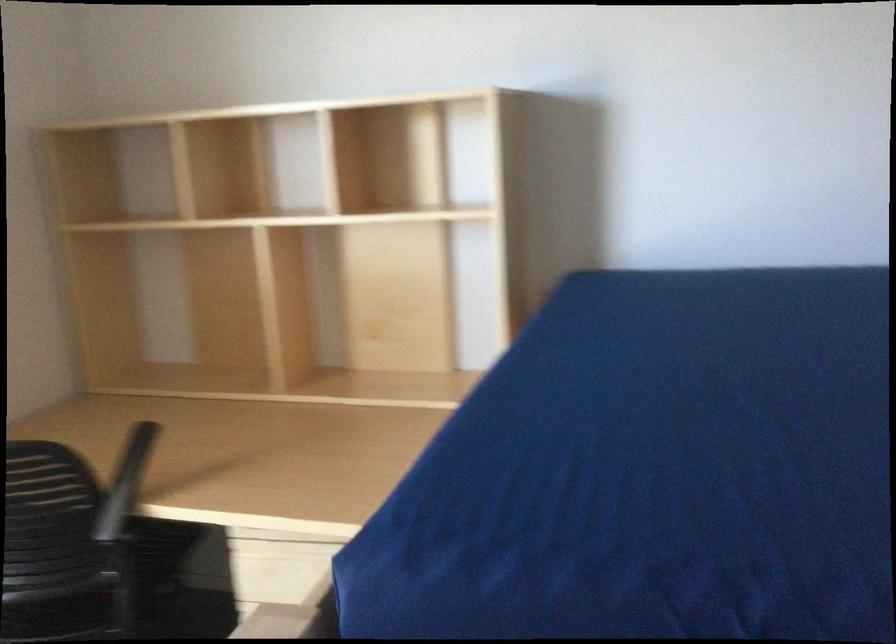
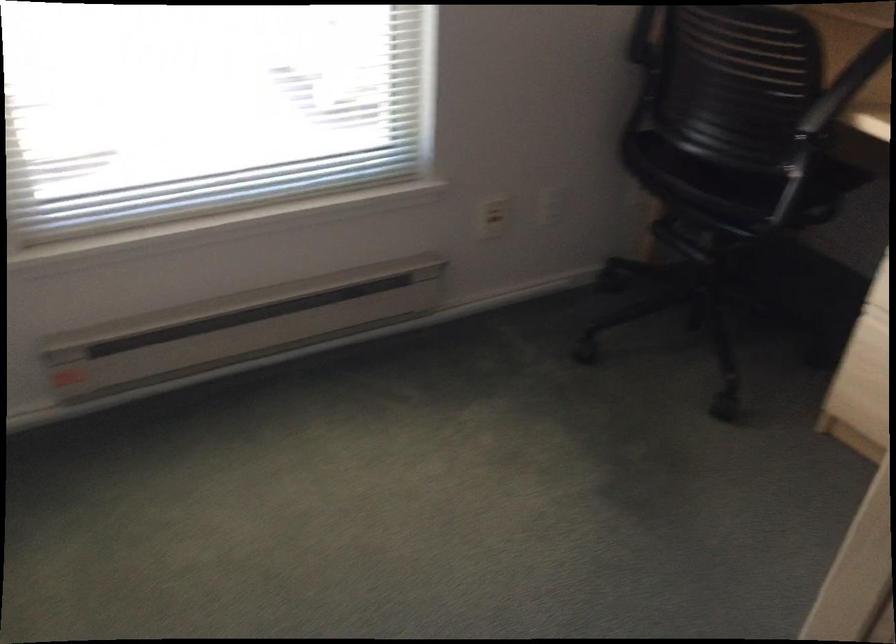
First-person continuous shooting, in which direction is the camera rotating?

The camera rotated toward left-down.